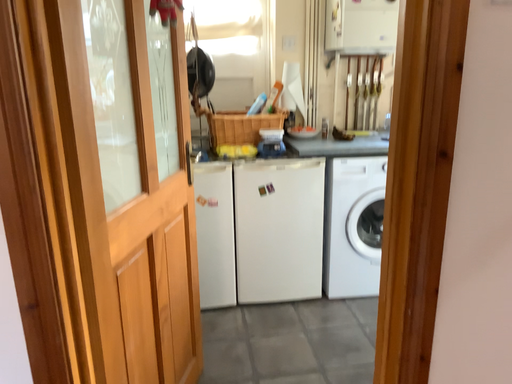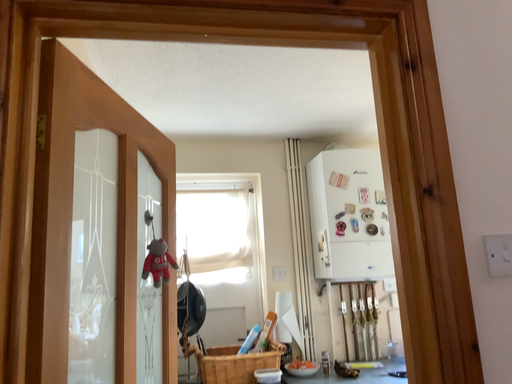
Question: How did the camera likely rotate when shooting the video?

Choices:
 (A) rotated downward
 (B) rotated upward

Answer: (B)